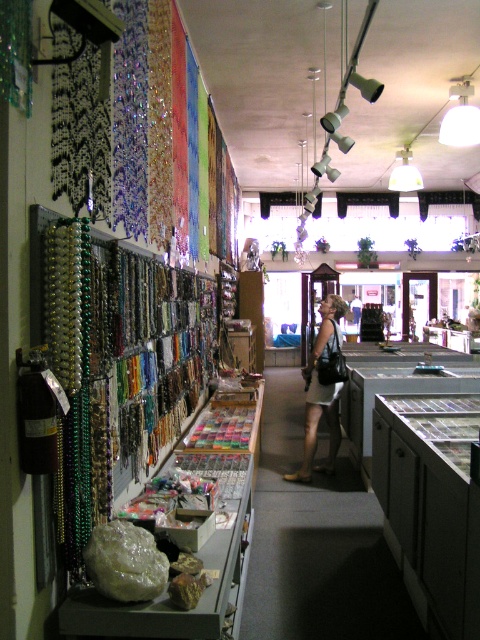
Question: Can you confirm if green matte beads at left is wider than leather skirt at center?

Choices:
 (A) yes
 (B) no

Answer: (B)

Question: Does green matte beads at left appear on the left side of leather skirt at center?

Choices:
 (A) yes
 (B) no

Answer: (A)

Question: Which of the following is the farthest from the observer?

Choices:
 (A) green matte beads at left
 (B) leather skirt at center

Answer: (B)

Question: Which point is farther from the camera taking this photo?

Choices:
 (A) (334, 364)
 (B) (43, 333)

Answer: (A)

Question: In this image, where is green matte beads at left located relative to leather skirt at center?

Choices:
 (A) above
 (B) below

Answer: (A)